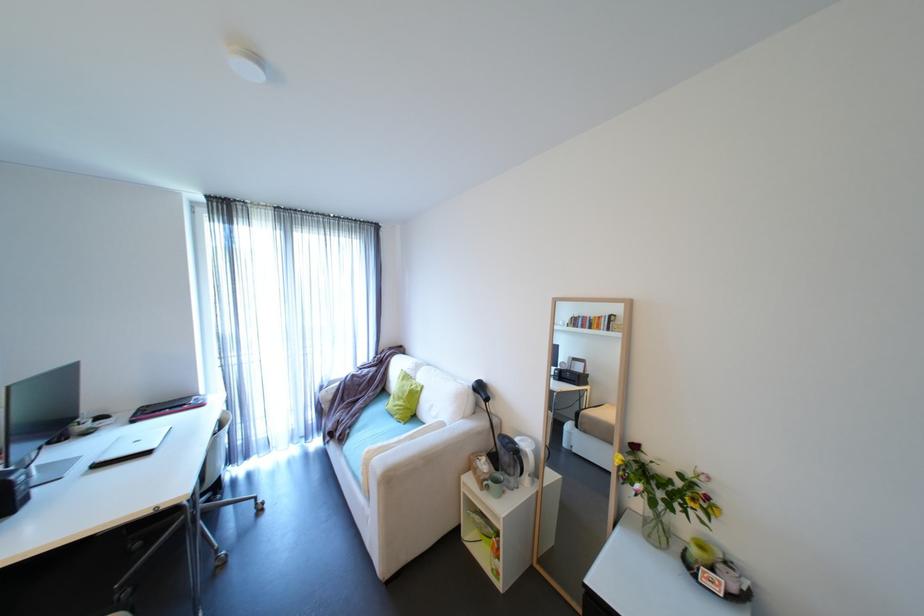
Image resolution: width=924 pixels, height=616 pixels. Identify the location of curtain edge. (234, 322).